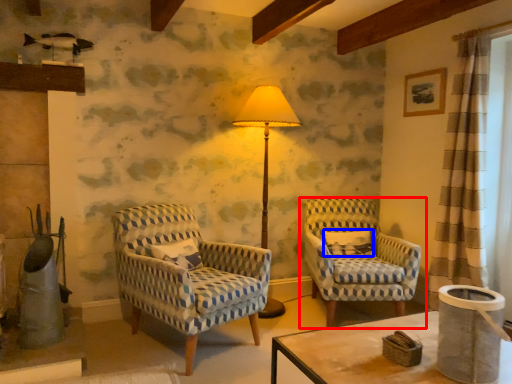
Question: Which object appears closest to the camera in this image, chair (highlighted by a red box) or pillow (highlighted by a blue box)?

Choices:
 (A) chair
 (B) pillow

Answer: (A)